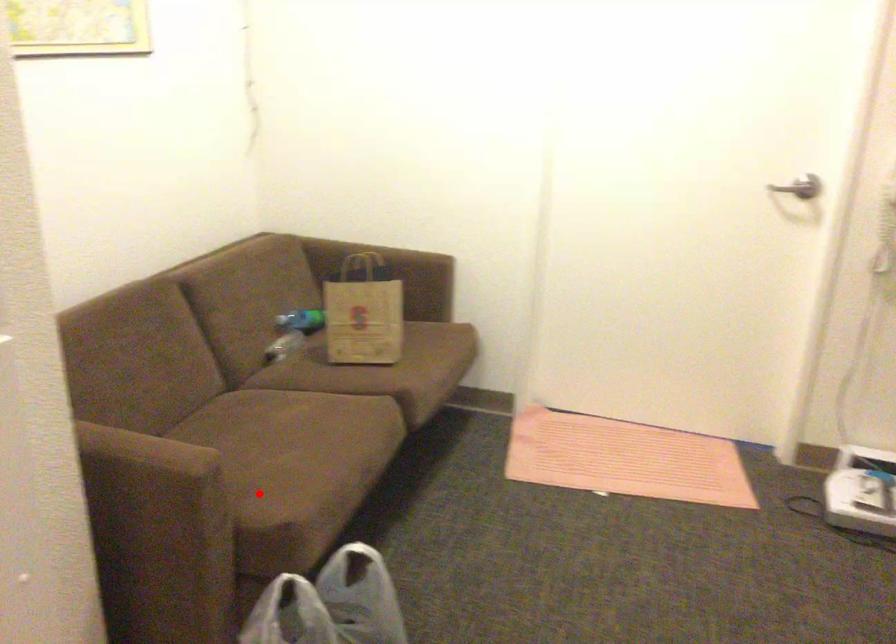
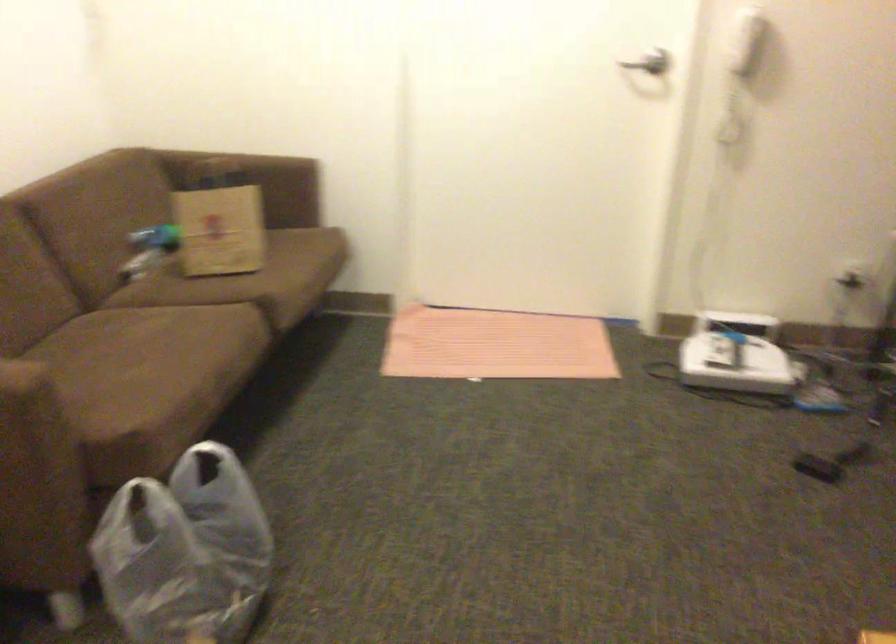
The point at the highlighted location is marked in the first image. Where is the corresponding point in the second image?

(110, 402)